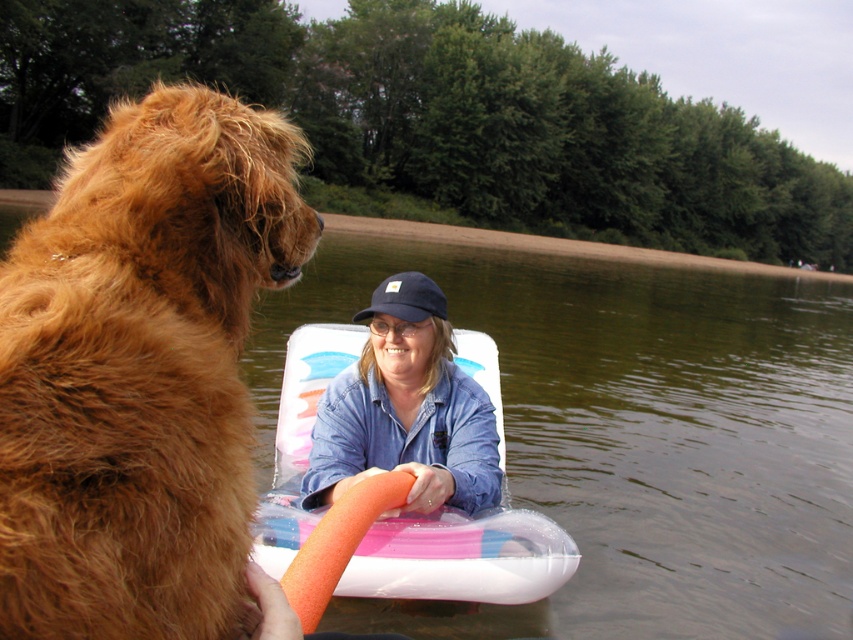
Does clear water at center have a greater height compared to blue denim jacket at center?

Correct, clear water at center is much taller as blue denim jacket at center.

Describe the element at coordinates (630, 435) in the screenshot. I see `clear water at center` at that location.

Where is `clear water at center`? This screenshot has width=853, height=640. clear water at center is located at coordinates (630, 435).

The height and width of the screenshot is (640, 853). What are the coordinates of `clear water at center` in the screenshot? It's located at (630, 435).

Between golden fur dog at left and translucent plastic raft at center, which one is positioned higher?

Positioned higher is golden fur dog at left.

Who is shorter, golden fur dog at left or translucent plastic raft at center?

translucent plastic raft at center is shorter.

Locate an element on the screen. golden fur dog at left is located at coordinates (141, 371).

Is golden fur dog at left further to the viewer compared to blue fabric baseball cap at center?

No.

Identify the location of golden fur dog at left. The height and width of the screenshot is (640, 853). (141, 371).